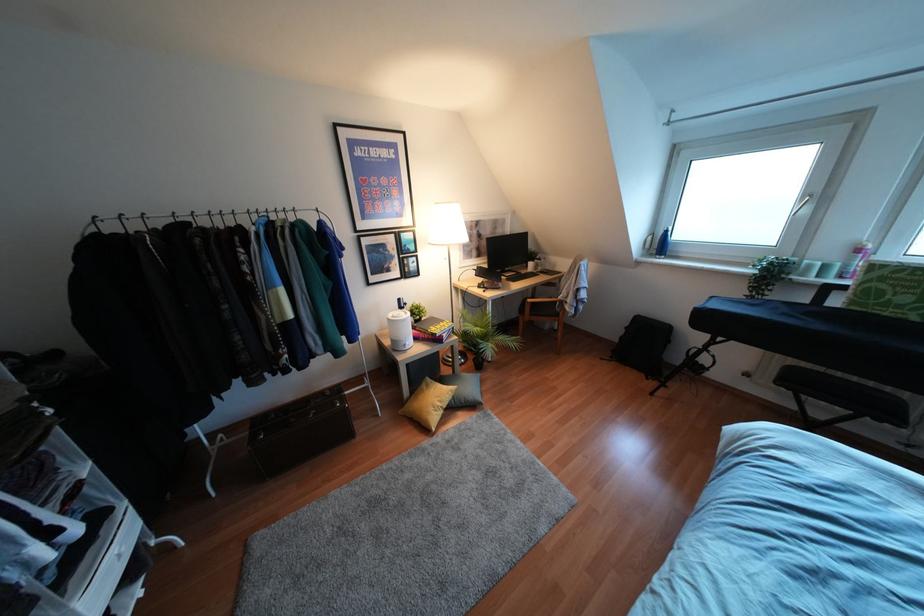
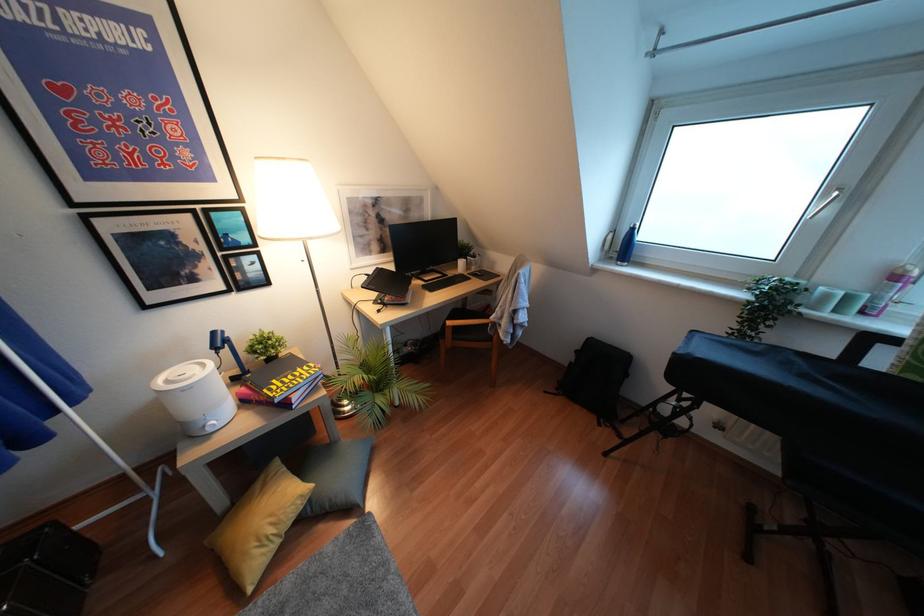
In the second image, find the point that corresponds to point 439,403 in the first image.

(271, 530)